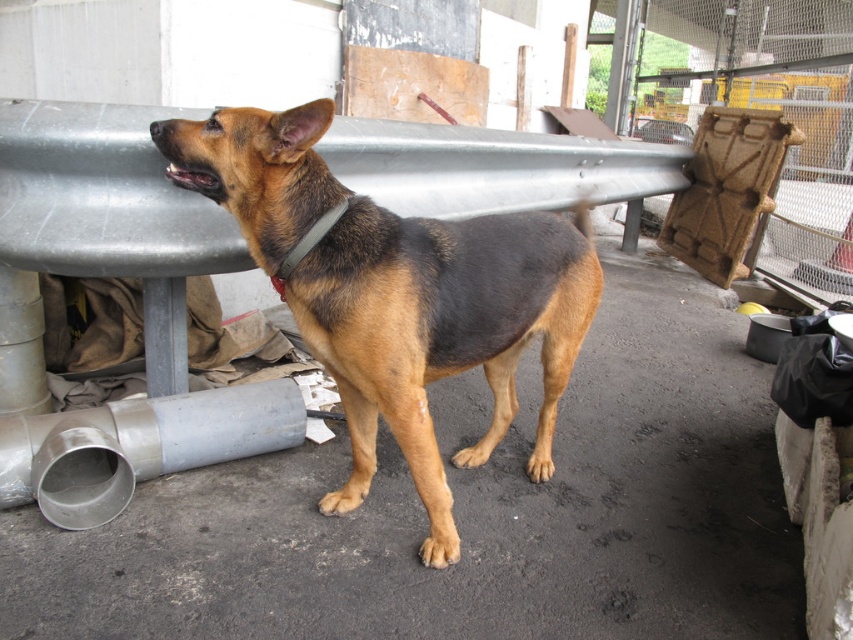
Does brown fur dog at center have a smaller size compared to black leather neckband at center?

No, brown fur dog at center is not smaller than black leather neckband at center.

Where is `brown fur dog at center`? Image resolution: width=853 pixels, height=640 pixels. brown fur dog at center is located at coordinates (397, 292).

I want to click on brown fur dog at center, so pos(397,292).

Can you confirm if silver metallic pipe at lower left is positioned to the right of black leather neckband at center?

No, silver metallic pipe at lower left is not to the right of black leather neckband at center.

At what (x,y) coordinates should I click in order to perform the action: click on silver metallic pipe at lower left. Please return your answer as a coordinate pair (x, y). Looking at the image, I should click on (137, 445).

Who is more distant from viewer, (308, 160) or (138, 480)?

The point (138, 480) is behind.

What do you see at coordinates (397, 292) in the screenshot? Image resolution: width=853 pixels, height=640 pixels. I see `brown fur dog at center` at bounding box center [397, 292].

In order to click on brown fur dog at center in this screenshot , I will do `click(397, 292)`.